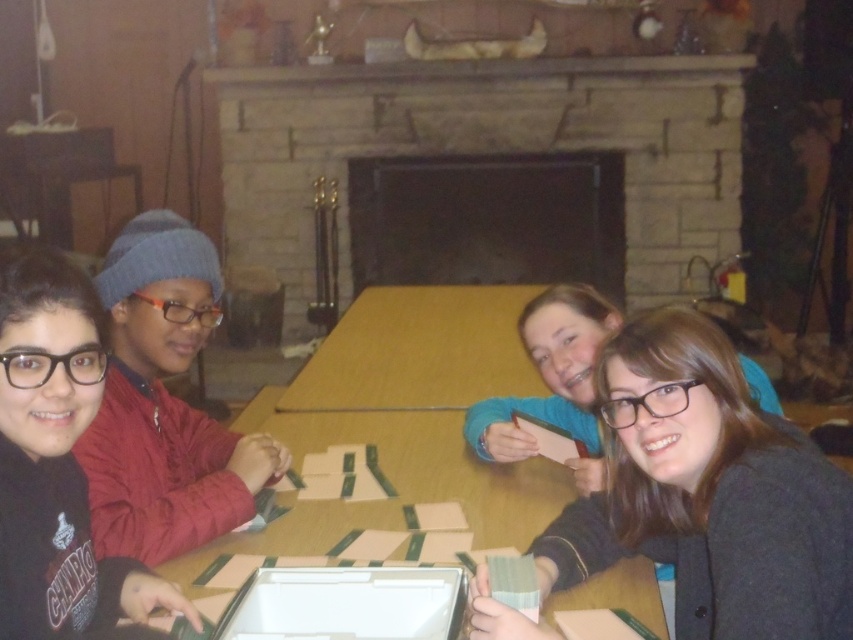
You are a photographer setting up a shot of the scene. You need to ensure that the stone fireplace at center and the black matte beanie at left are both in focus. Given that your camera can only focus on objects within a 1.2 meter height range, will both objects be in focus?

The stone fireplace at center has a greater height compared to the black matte beanie at left. Since the fireplace is taller, if the camera is focused on the fireplace, the beanie might be too low to be within the 1.2 meter focus range. Alternatively, focusing on the beanie might leave the fireplace out of range. To ensure both are in focus, adjust the focus point to a midpoint between their heights.